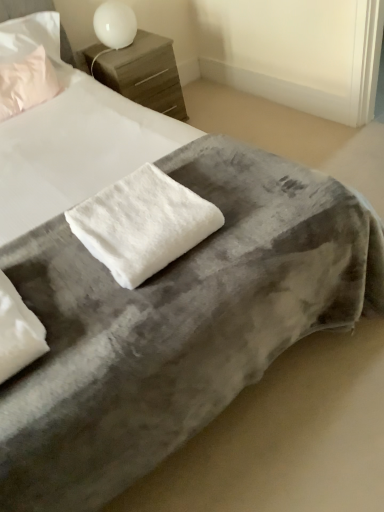
The image size is (384, 512). Find the location of `vacant space that is in between white fluffy towel at center and white fluffy pillow at lower left, the second pillow in the top-to-bottom sequence`. vacant space that is in between white fluffy towel at center and white fluffy pillow at lower left, the second pillow in the top-to-bottom sequence is located at coordinates (72, 286).